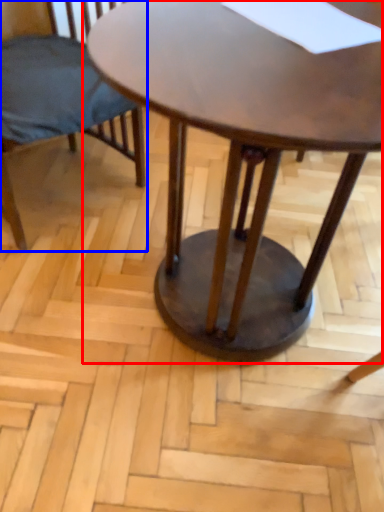
Question: Which of the following is the closest to the observer, coffee table (highlighted by a red box) or chair (highlighted by a blue box)?

Choices:
 (A) coffee table
 (B) chair

Answer: (A)